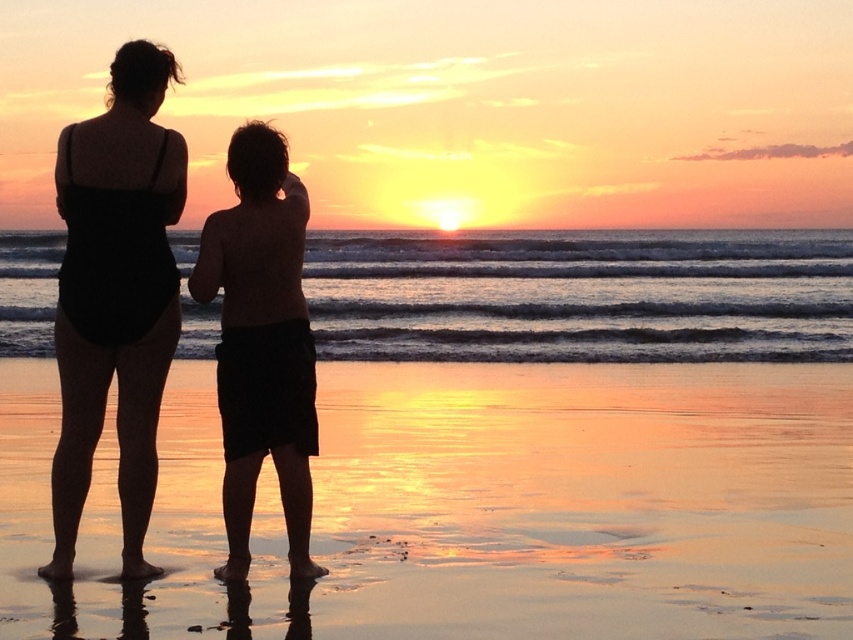
Question: Is shiny sand at lower center positioned before black matte swimsuit at left?

Choices:
 (A) no
 (B) yes

Answer: (B)

Question: Among these objects, which one is farthest from the camera?

Choices:
 (A) shiny sand at lower center
 (B) silhouette shorts at center

Answer: (B)

Question: Can you confirm if black matte swimsuit at left is bigger than silhouette shorts at center?

Choices:
 (A) no
 (B) yes

Answer: (A)

Question: Which of the following is the closest to the observer?

Choices:
 (A) black matte swimsuit at left
 (B) shiny sand at lower center
 (C) silhouette shorts at center

Answer: (B)

Question: Does shiny sand at lower center appear over silhouette shorts at center?

Choices:
 (A) no
 (B) yes

Answer: (A)

Question: Which point is closer to the camera taking this photo?

Choices:
 (A) (286, 172)
 (B) (775, 515)

Answer: (A)